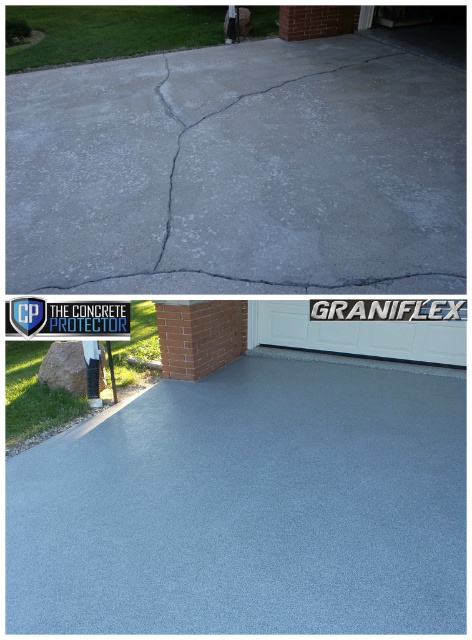
Who is positioned more to the left, gray concrete crack at upper center or white plastic sign at upper center?

From the viewer's perspective, white plastic sign at upper center appears more on the left side.

Is point (235, 252) less distant than point (117, 320)?

Yes, it is.

Locate an element on the screen. The height and width of the screenshot is (640, 472). gray concrete crack at upper center is located at coordinates (276, 161).

Does gray concrete at upper center appear on the right side of gray concrete crack at upper center?

Yes, gray concrete at upper center is to the right of gray concrete crack at upper center.

Does gray concrete at upper center have a larger size compared to gray concrete crack at upper center?

Incorrect, gray concrete at upper center is not larger than gray concrete crack at upper center.

Is point (258, 134) positioned behind point (321, 202)?

Yes.

Where is `gray concrete at upper center`? gray concrete at upper center is located at coordinates (238, 172).

Does smooth gray concrete at center have a larger size compared to white plastic sign at upper center?

Yes, smooth gray concrete at center is bigger than white plastic sign at upper center.

Can you confirm if smooth gray concrete at center is shorter than white plastic sign at upper center?

No, smooth gray concrete at center is not shorter than white plastic sign at upper center.

Which is behind, point (294, 612) or point (23, 316)?

Point (23, 316)

You are a GUI agent. You are given a task and a screenshot of the screen. Output one action in this format:
    pyautogui.click(x=<x>, y=<y>)
    Task: Click on the smooth gray concrete at center
    This screenshot has height=640, width=472.
    Given the screenshot: What is the action you would take?
    pyautogui.click(x=249, y=508)